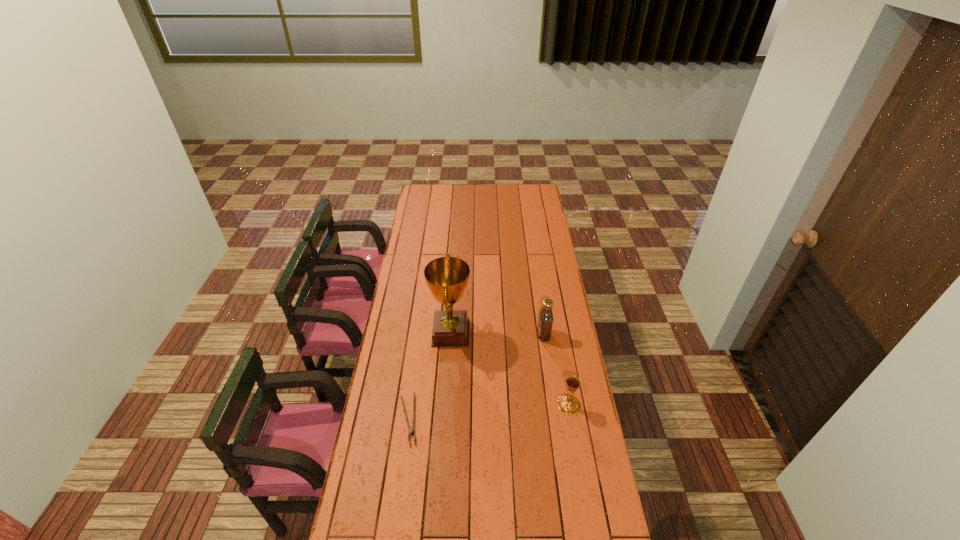
Identify which object is the second nearest to the tallest object. Please provide its 2D coordinates. Your answer should be formatted as a tuple, i.e. [(x, y)], where the tuple contains the x and y coordinates of a point satisfying the conditions above.

[(545, 322)]

This screenshot has height=540, width=960. Identify the location of vacant space that satisfies the following two spatial constraints: 1. on the front-facing side of the second tallest object; 2. on the right side of the second shortest object. click(x=554, y=404).

Where is `vacant region that satisfies the following two spatial constraints: 1. on the back side of the chalice; 2. on the plaque of the tallest object`? vacant region that satisfies the following two spatial constraints: 1. on the back side of the chalice; 2. on the plaque of the tallest object is located at coordinates (557, 333).

In order to click on free region that satisfies the following two spatial constraints: 1. on the front-facing side of the second tallest object; 2. on the back side of the third tallest object in this screenshot , I will do `click(554, 404)`.

Identify the location of vacant space that satisfies the following two spatial constraints: 1. on the plaque of the chalice; 2. on the right side of the second object from left to right. (446, 404).

Image resolution: width=960 pixels, height=540 pixels. I want to click on free space that satisfies the following two spatial constraints: 1. on the front-facing side of the chalice; 2. on the right side of the third shortest object, so click(554, 404).

Where is `free space that satisfies the following two spatial constraints: 1. on the plaque of the second object from left to right; 2. on the front side of the leftmost object`? The height and width of the screenshot is (540, 960). free space that satisfies the following two spatial constraints: 1. on the plaque of the second object from left to right; 2. on the front side of the leftmost object is located at coordinates (445, 420).

I want to click on free location that satisfies the following two spatial constraints: 1. on the front-facing side of the chalice; 2. on the left side of the vodka, so click(x=554, y=404).

Where is `free location that satisfies the following two spatial constraints: 1. on the back side of the chalice; 2. on the plaque of the third object from right to left`? free location that satisfies the following two spatial constraints: 1. on the back side of the chalice; 2. on the plaque of the third object from right to left is located at coordinates (557, 333).